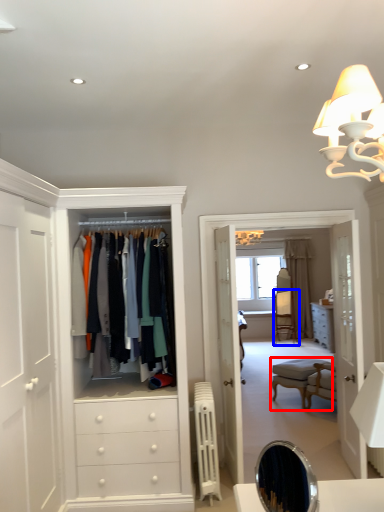
Question: Which object appears closest to the camera in this image, vanity (highlighted by a red box) or armchair (highlighted by a blue box)?

Choices:
 (A) vanity
 (B) armchair

Answer: (A)